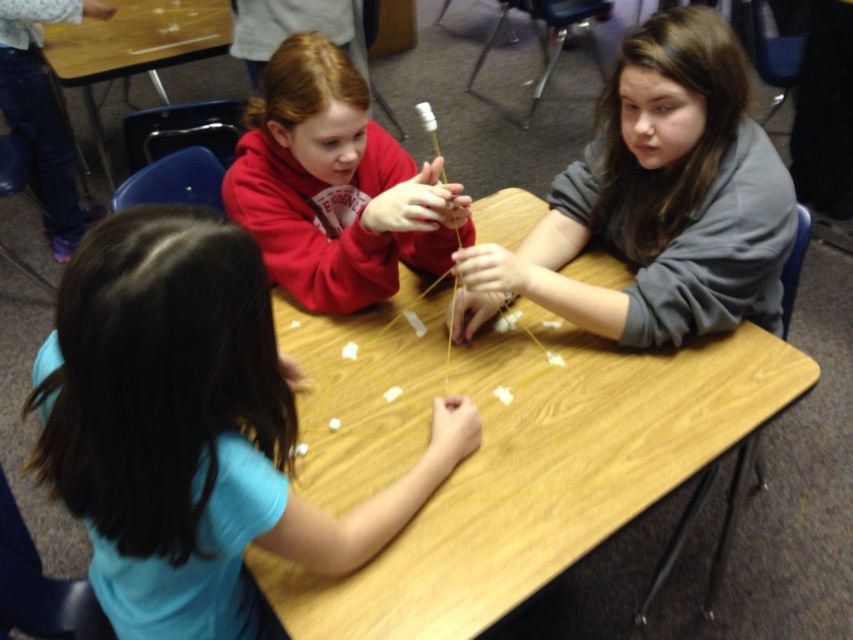
Question: Based on their relative distances, which object is nearer to the gray matte sweater at upper right?

Choices:
 (A) wooden table at center
 (B) blue matte shirt at center
 (C) matte red hoodie at upper center
 (D) wooden table at upper left

Answer: (A)

Question: Can you confirm if matte red hoodie at upper center is positioned to the left of wooden table at upper left?

Choices:
 (A) no
 (B) yes

Answer: (A)

Question: Does gray matte sweater at upper right appear on the right side of wooden table at upper left?

Choices:
 (A) yes
 (B) no

Answer: (A)

Question: Can you confirm if blue matte shirt at center is positioned to the right of gray matte sweater at upper right?

Choices:
 (A) yes
 (B) no

Answer: (B)

Question: Which object is positioned closest to the blue matte shirt at center?

Choices:
 (A) matte red hoodie at upper center
 (B) wooden table at center
 (C) wooden table at upper left

Answer: (B)

Question: Among these objects, which one is farthest from the camera?

Choices:
 (A) wooden table at center
 (B) matte red hoodie at upper center

Answer: (B)